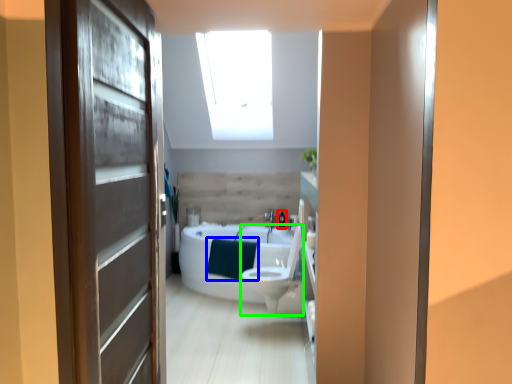
Question: Based on their relative distances, which object is farther from toiletry (highlighted by a red box)? Choose from blanket (highlighted by a blue box) and toilet bowl (highlighted by a green box).

Choices:
 (A) blanket
 (B) toilet bowl

Answer: (B)